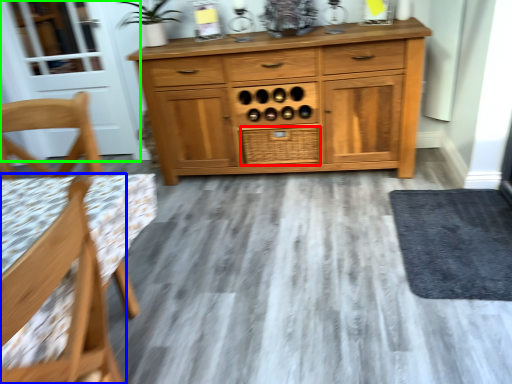
Question: Which object is the closest to the drawer (highlighted by a red box)? Choose among these: chair (highlighted by a blue box) or screen door (highlighted by a green box).

Choices:
 (A) chair
 (B) screen door

Answer: (B)